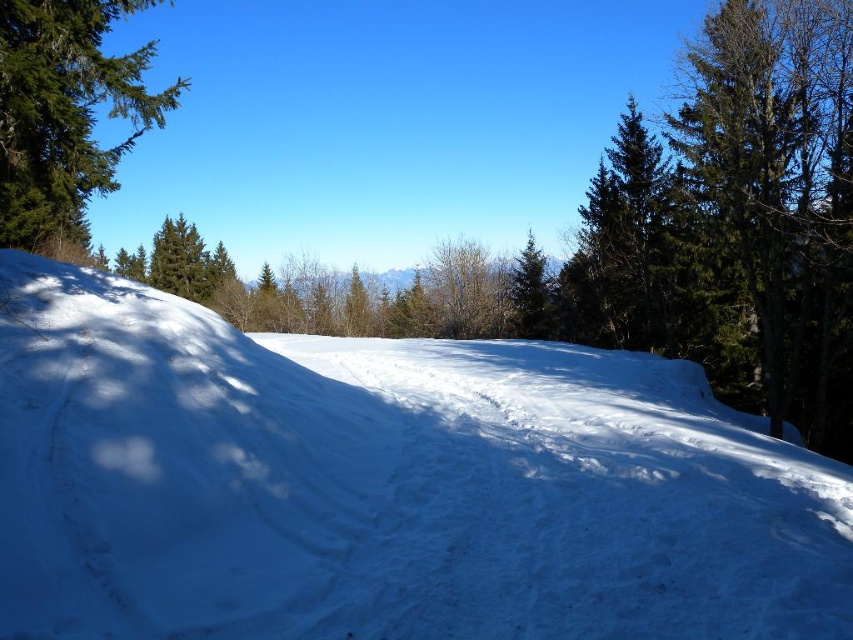
You are planning a snow sculpture project and need to know which material is more abundant between the white powdery snow at center and the green textured pine tree at upper left. Based on the scene, which one would you choose?

The white powdery snow at center is more abundant because it is thinner than the green textured pine tree at upper left, implying there is more snow available for the sculpture.

You are standing at the bottom of the slope and want to walk towards the green textured pine tree at upper left. Which direction should you walk to avoid the white powdery snow at center?

You should walk to the left side of the slope to avoid the white powdery snow at center, as the green textured pine tree at upper left is located in that direction and the snow at center is closer to you, so moving left would take you around it.

Looking at this image, you are a hiker planning to walk from the green textured pine tree at upper left to the white powdery snow at center. Based on the scene, will you need to walk uphill or downhill?

The white powdery snow at center is positioned under the green textured pine tree at upper left, which means the pine tree is higher up. Therefore, you would need to walk uphill towards the green textured pine tree at upper left, but since you are going from the tree to the snow, you would be walking downhill.